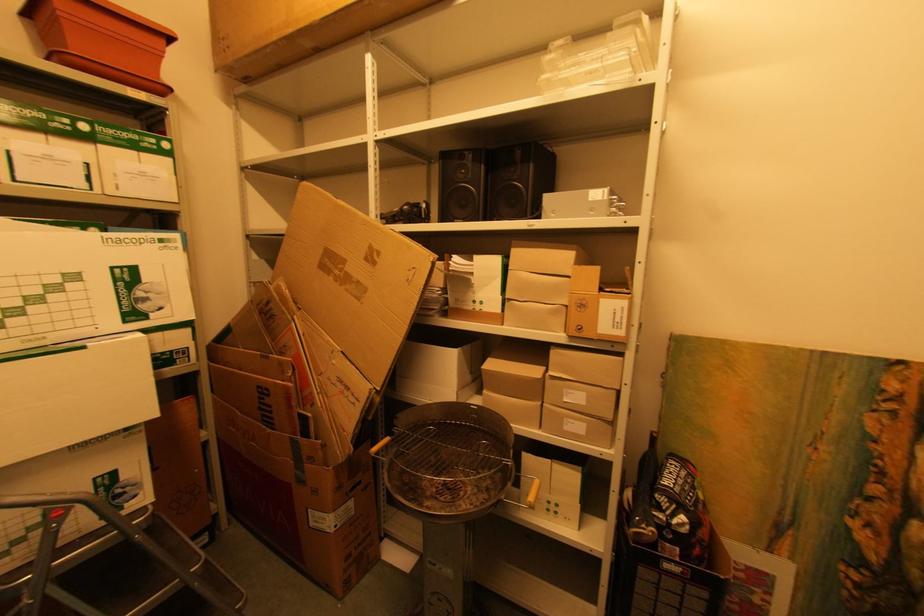
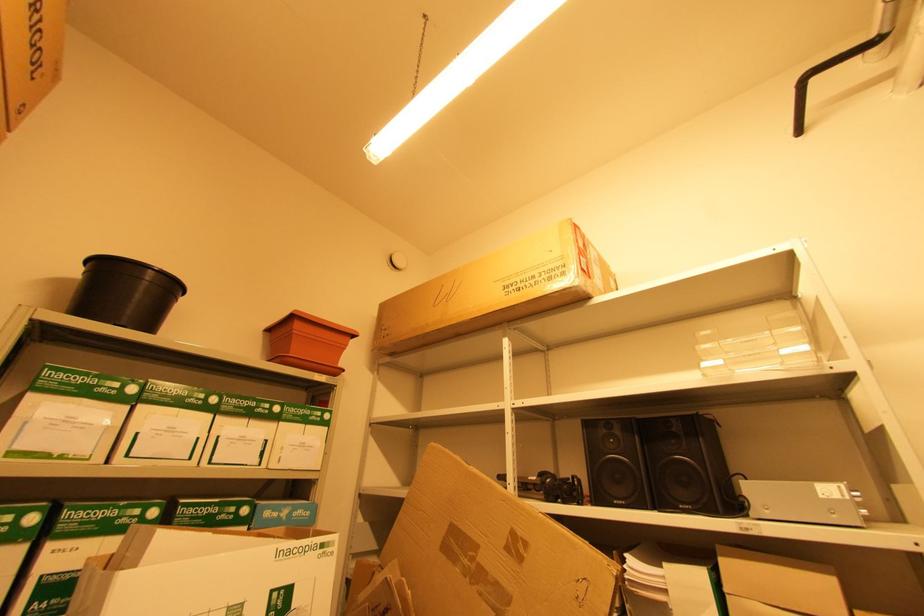
Question: The images are taken continuously from a first-person perspective. In which direction is your viewpoint rotating?

Choices:
 (A) Left
 (B) Right
 (C) Up
 (D) Down

Answer: (C)